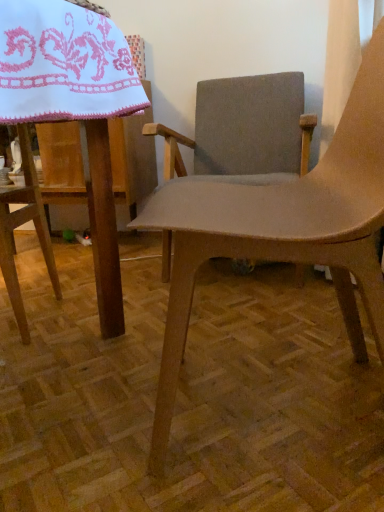
Question: Does textured gray fabric chair at center, arranged as the second chair when viewed from the front, have a lesser height compared to matte brown chair at center, the 1th chair when ordered from front to back?

Choices:
 (A) yes
 (B) no

Answer: (A)

Question: Does textured gray fabric chair at center, arranged as the second chair when viewed from the front, have a lesser width compared to matte brown chair at center, the second chair positioned from the back?

Choices:
 (A) no
 (B) yes

Answer: (A)

Question: Is textured gray fabric chair at center, arranged as the second chair when viewed from the front, bigger than matte brown chair at center, the 1th chair when ordered from front to back?

Choices:
 (A) no
 (B) yes

Answer: (B)

Question: From a real-world perspective, is textured gray fabric chair at center, arranged as the second chair when viewed from the front, under matte brown chair at center, the second chair positioned from the back?

Choices:
 (A) no
 (B) yes

Answer: (A)

Question: Is textured gray fabric chair at center, arranged as the second chair when viewed from the front, to the right of matte brown chair at center, the second chair positioned from the back, from the viewer's perspective?

Choices:
 (A) yes
 (B) no

Answer: (A)

Question: Is textured gray fabric chair at center, the first chair when ordered from back to front, at the left side of matte brown chair at center, the 1th chair when ordered from front to back?

Choices:
 (A) yes
 (B) no

Answer: (B)

Question: From a real-world perspective, does white embroidered cloth at upper left sit lower than textured gray fabric chair at center, the first chair when ordered from back to front?

Choices:
 (A) yes
 (B) no

Answer: (B)

Question: From the image's perspective, is white embroidered cloth at upper left on textured gray fabric chair at center, the first chair when ordered from back to front?

Choices:
 (A) no
 (B) yes

Answer: (A)

Question: Is white embroidered cloth at upper left outside textured gray fabric chair at center, arranged as the second chair when viewed from the front?

Choices:
 (A) no
 (B) yes

Answer: (B)

Question: Is white embroidered cloth at upper left smaller than textured gray fabric chair at center, arranged as the second chair when viewed from the front?

Choices:
 (A) yes
 (B) no

Answer: (A)

Question: Does white embroidered cloth at upper left appear on the left side of textured gray fabric chair at center, the first chair when ordered from back to front?

Choices:
 (A) no
 (B) yes

Answer: (B)

Question: Would you consider white embroidered cloth at upper left to be distant from textured gray fabric chair at center, the first chair when ordered from back to front?

Choices:
 (A) yes
 (B) no

Answer: (A)

Question: Does matte brown chair at center, the second chair positioned from the back, have a smaller size compared to white embroidered cloth at upper left?

Choices:
 (A) yes
 (B) no

Answer: (B)